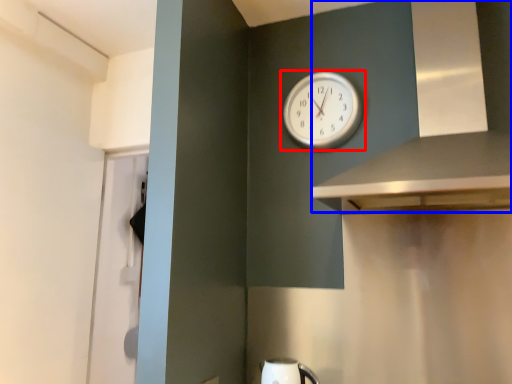
Question: Which of the following is the farthest to the observer, wall clock (highlighted by a red box) or vent (highlighted by a blue box)?

Choices:
 (A) wall clock
 (B) vent

Answer: (A)